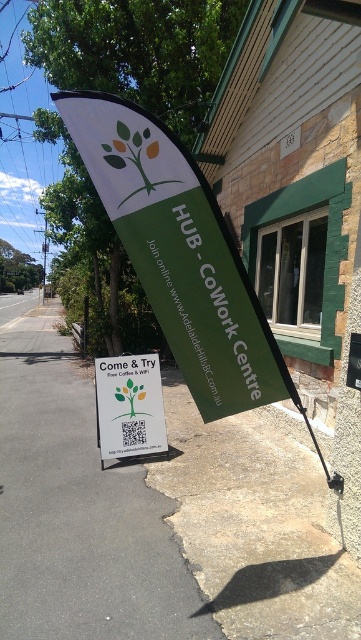
Question: Is gray concrete pavement at center to the right of white paper sign at center from the viewer's perspective?

Choices:
 (A) yes
 (B) no

Answer: (B)

Question: Which point is farther to the camera?

Choices:
 (A) white paper sign at center
 (B) gray concrete pavement at center

Answer: (A)

Question: Which point is closer to the camera taking this photo?

Choices:
 (A) (146, 384)
 (B) (183, 596)

Answer: (B)

Question: Which point is closer to the camera?

Choices:
 (A) gray concrete pavement at center
 (B) white paper sign at center

Answer: (A)

Question: Does gray concrete pavement at center appear on the right side of white paper sign at center?

Choices:
 (A) no
 (B) yes

Answer: (A)

Question: Considering the relative positions of gray concrete pavement at center and white paper sign at center in the image provided, where is gray concrete pavement at center located with respect to white paper sign at center?

Choices:
 (A) above
 (B) below

Answer: (B)